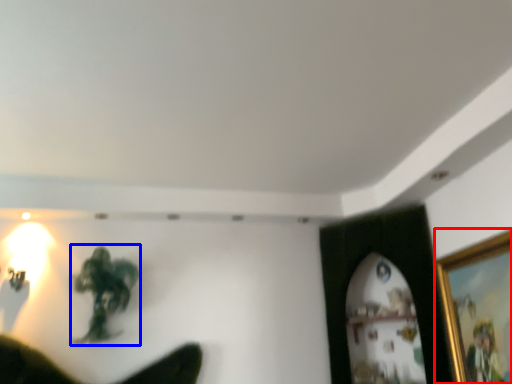
Question: Which of the following is the farthest to the observer, picture frame (highlighted by a red box) or person (highlighted by a blue box)?

Choices:
 (A) picture frame
 (B) person

Answer: (B)